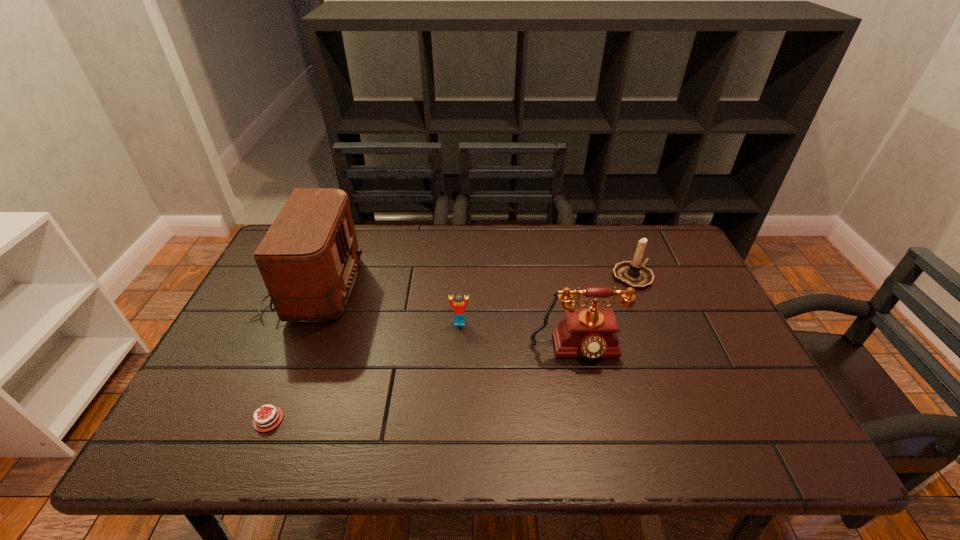
Image resolution: width=960 pixels, height=540 pixels. I want to click on vacant space that satisfies the following two spatial constraints: 1. on the front side of the rightmost object; 2. on the front panel of the tallest object, so click(x=637, y=287).

Locate an element on the screen. Image resolution: width=960 pixels, height=540 pixels. vacant space that satisfies the following two spatial constraints: 1. on the back side of the nearest object; 2. on the right side of the rightmost object is located at coordinates (325, 276).